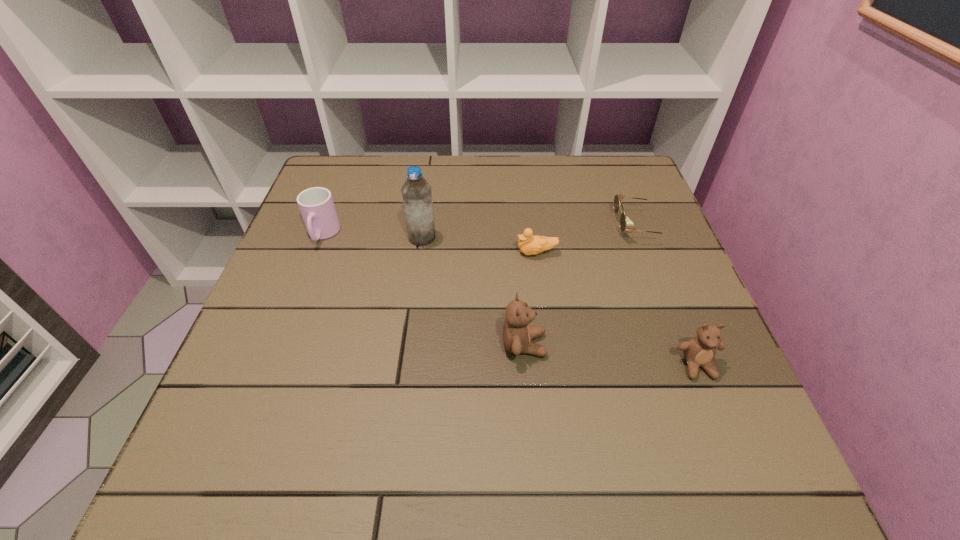
Where is `free space located on the face of the duckling`? free space located on the face of the duckling is located at coordinates (402, 253).

This screenshot has height=540, width=960. I want to click on free point located on the face of the duckling, so pyautogui.click(x=341, y=253).

The height and width of the screenshot is (540, 960). Find the location of `vacant area situated on the face of the duckling`. vacant area situated on the face of the duckling is located at coordinates (345, 253).

Locate an element on the screen. Image resolution: width=960 pixels, height=540 pixels. free space located on the left of the water bottle is located at coordinates (378, 238).

You are a GUI agent. You are given a task and a screenshot of the screen. Output one action in this format:
    pyautogui.click(x=<x>, y=<y>)
    Task: Click on the vacant area situated with the handle on the side of the cup
    
    Given the screenshot: What is the action you would take?
    pos(300,293)

Locate an element on the screen. This screenshot has width=960, height=540. vacant space located on the front lenses of the sunglasses is located at coordinates (520, 226).

This screenshot has width=960, height=540. I want to click on vacant region located on the front lenses of the sunglasses, so click(x=579, y=226).

Where is `free space located 0.130m on the front lenses of the sunglasses`? The width and height of the screenshot is (960, 540). free space located 0.130m on the front lenses of the sunglasses is located at coordinates point(562,226).

I want to click on object present at the near edge, so click(699, 351).

Locate an element on the screen. object located in the left edge section of the desktop is located at coordinates (316, 205).